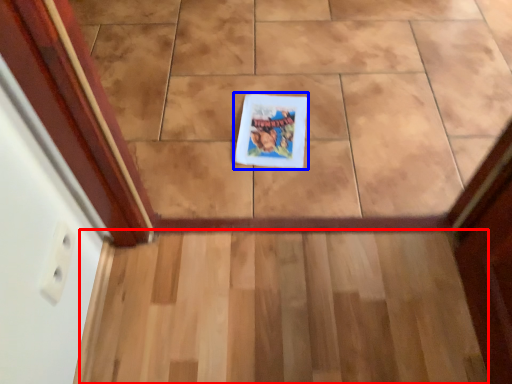
Question: Which object is further to the camera taking this photo, stairs (highlighted by a red box) or book cover (highlighted by a blue box)?

Choices:
 (A) stairs
 (B) book cover

Answer: (B)